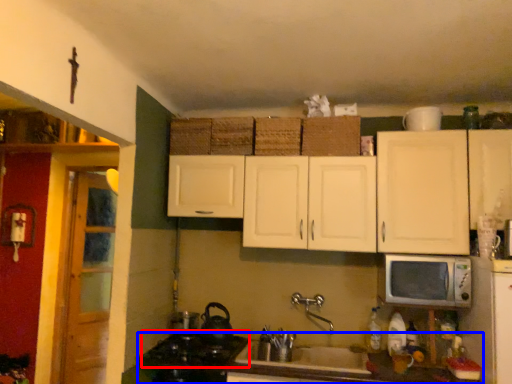
Question: Which of the following is the closest to the observer, gas stove (highlighted by a red box) or countertop (highlighted by a blue box)?

Choices:
 (A) gas stove
 (B) countertop

Answer: (B)